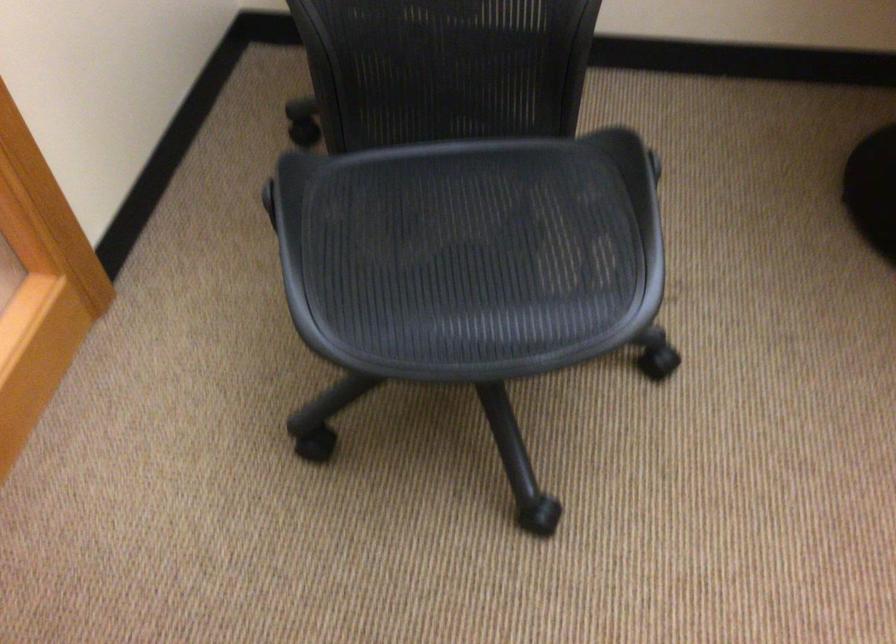
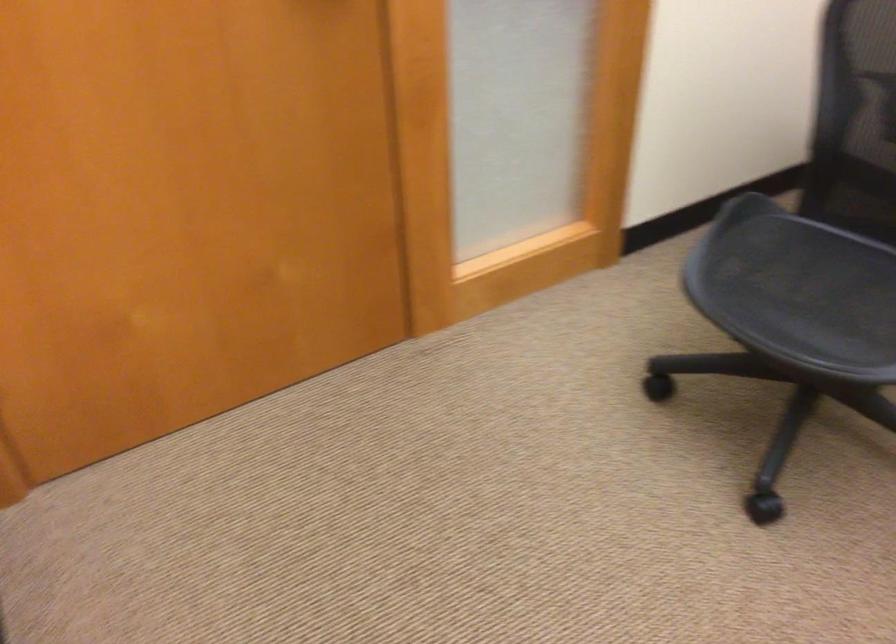
The point at (468, 270) is marked in the first image. Where is the corresponding point in the second image?

(805, 295)